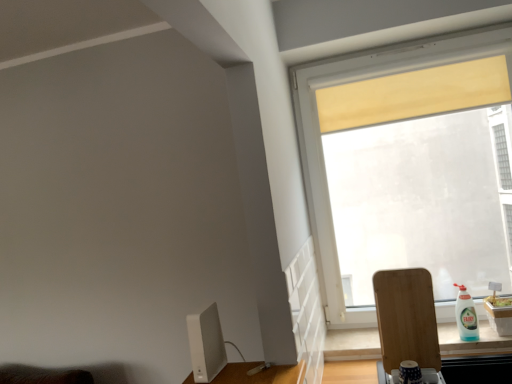
Question: Is white plastic bottle at right thinner than transparent glass window at upper right?

Choices:
 (A) yes
 (B) no

Answer: (B)

Question: Is white plastic bottle at right shorter than transparent glass window at upper right?

Choices:
 (A) yes
 (B) no

Answer: (A)

Question: From the image's perspective, would you say white plastic bottle at right is positioned over transparent glass window at upper right?

Choices:
 (A) no
 (B) yes

Answer: (A)

Question: Considering the relative sizes of white plastic bottle at right and transparent glass window at upper right in the image provided, is white plastic bottle at right bigger than transparent glass window at upper right?

Choices:
 (A) no
 (B) yes

Answer: (A)

Question: Is transparent glass window at upper right a part of white plastic bottle at right?

Choices:
 (A) yes
 (B) no

Answer: (B)

Question: From their relative heights in the image, would you say transparent glass window at upper right is taller or shorter than white plastic bottle at right?

Choices:
 (A) tall
 (B) short

Answer: (A)

Question: Would you say transparent glass window at upper right is inside or outside white plastic bottle at right?

Choices:
 (A) inside
 (B) outside

Answer: (B)

Question: From a real-world perspective, is transparent glass window at upper right above or below white plastic bottle at right?

Choices:
 (A) below
 (B) above

Answer: (B)

Question: Considering their positions, is transparent glass window at upper right located in front of or behind white plastic bottle at right?

Choices:
 (A) behind
 (B) front

Answer: (A)

Question: Is wooden cutting board at lower right in front of or behind white plastic bottle at right in the image?

Choices:
 (A) front
 (B) behind

Answer: (A)

Question: Based on their sizes in the image, would you say wooden cutting board at lower right is bigger or smaller than white plastic bottle at right?

Choices:
 (A) small
 (B) big

Answer: (B)

Question: Which is correct: wooden cutting board at lower right is inside white plastic bottle at right, or outside of it?

Choices:
 (A) inside
 (B) outside

Answer: (B)

Question: Considering the positions of point (402, 309) and point (462, 332), is point (402, 309) closer or farther from the camera than point (462, 332)?

Choices:
 (A) farther
 (B) closer

Answer: (B)

Question: From a real-world perspective, is white matte computer monitor at lower left above or below white plastic bottle at right?

Choices:
 (A) above
 (B) below

Answer: (A)

Question: In terms of size, does white matte computer monitor at lower left appear bigger or smaller than white plastic bottle at right?

Choices:
 (A) big
 (B) small

Answer: (A)